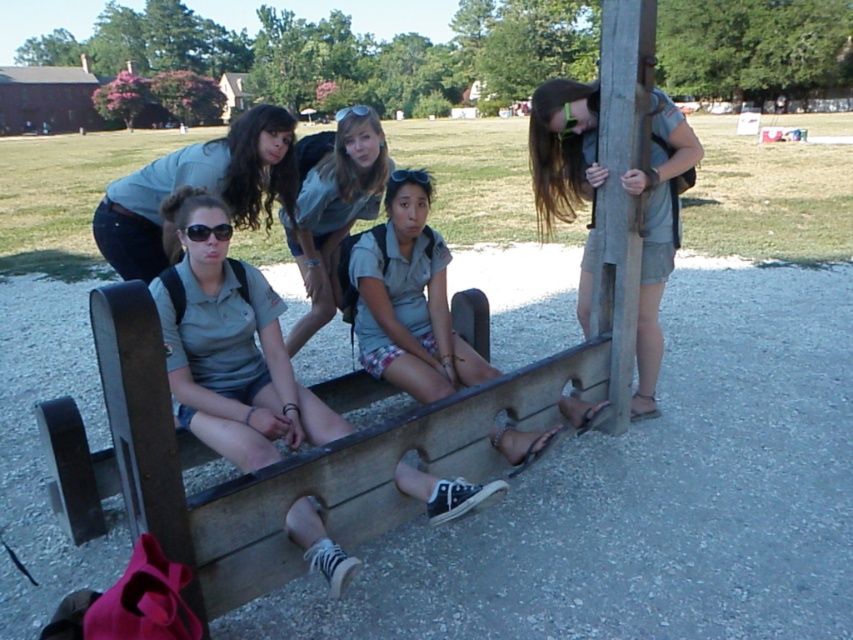
How much distance is there between gray fabric shirt at center and matte gray shirt at center?

The distance of gray fabric shirt at center from matte gray shirt at center is 36.22 inches.

Is point (204, 328) more distant than point (332, 147)?

No, it is in front of (332, 147).

Find the location of a particular element. This screenshot has height=640, width=853. gray fabric shirt at center is located at coordinates (230, 348).

Where is `gray fabric shirt at center`? This screenshot has height=640, width=853. gray fabric shirt at center is located at coordinates (230, 348).

Consider the image. Can you confirm if matte gray shirt at right is bigger than black plastic sunglasses at center?

Indeed, matte gray shirt at right has a larger size compared to black plastic sunglasses at center.

Which is behind, point (537, 177) or point (206, 237)?

The point (537, 177) is more distant.

Is point (584, 141) positioned after point (213, 234)?

That is True.

Locate an element on the screen. matte gray shirt at right is located at coordinates (659, 234).

Is wooden post at right smaller than black plastic sunglasses at center?

No, wooden post at right is not smaller than black plastic sunglasses at center.

From the picture: Who is shorter, wooden post at right or black plastic sunglasses at center?

Standing shorter between the two is black plastic sunglasses at center.

Does point (618, 336) come farther from viewer compared to point (225, 237)?

That is True.

In order to click on wooden post at right in this screenshot , I will do `click(619, 188)`.